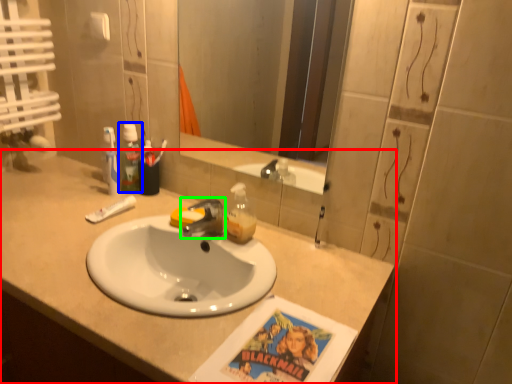
Question: Which is nearer to the countertop (highlighted by a red box)? mouthwash (highlighted by a blue box) or tap (highlighted by a green box).

Choices:
 (A) mouthwash
 (B) tap

Answer: (B)